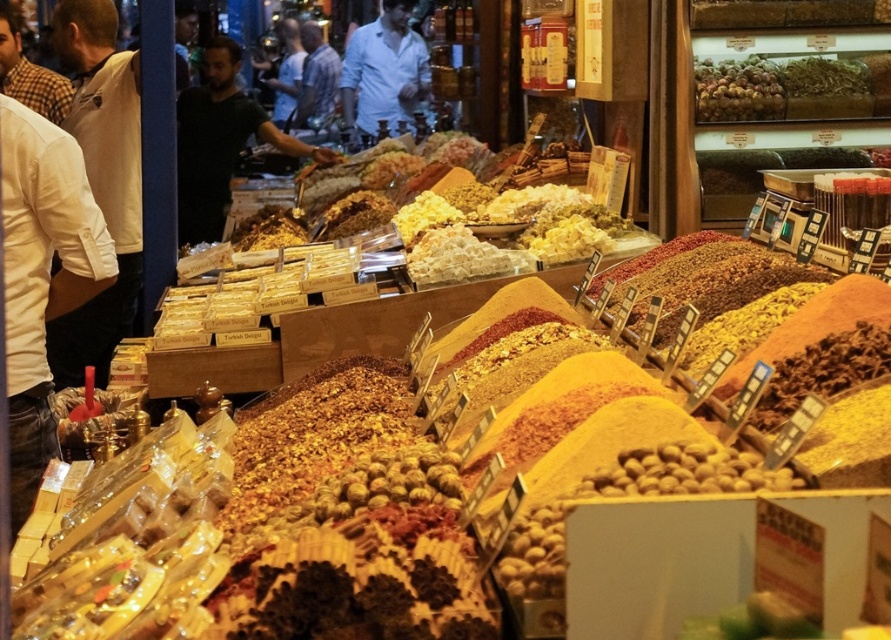
You are a customer in the spice market and want to ask both the black matte shirt at center and the light blue shirt at center for information about the spices. Since you can only approach one person at a time, which person should you approach first to minimize the distance you need to walk between them?

You should approach either the black matte shirt at center or the light blue shirt at center first because they are only 1.93 meters apart from each other, so the distance between them is fixed. You can choose either one, and the walking distance to the other will be the same.

You are a customer at the spice market and want to approach the vendor. You see the white shirt at left and the dark blue shirt at center. Which vendor should you approach if you want to buy a larger quantity of spices?

The white shirt at left is larger in size than the dark blue shirt at center, so you should approach the vendor wearing the white shirt at left as they might handle larger quantities of spices.